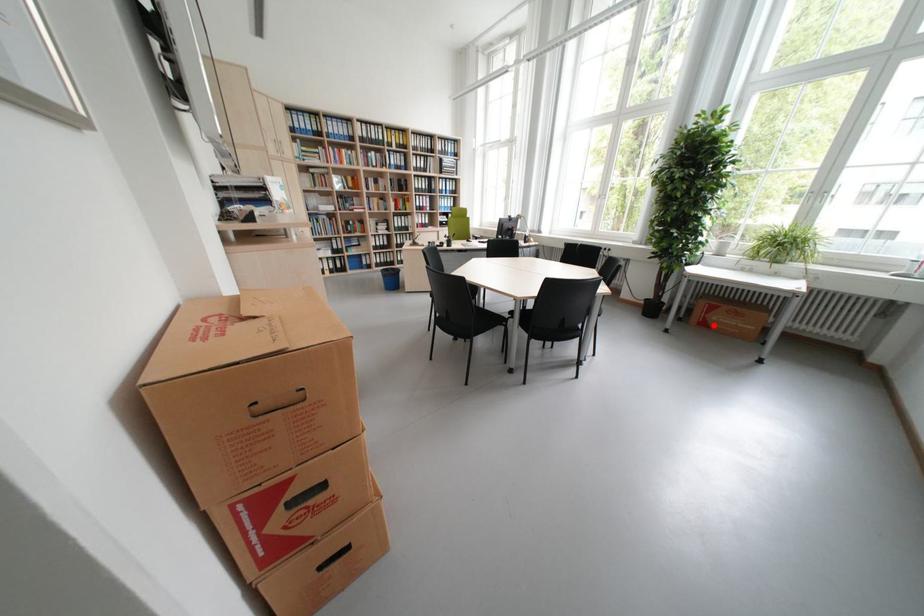
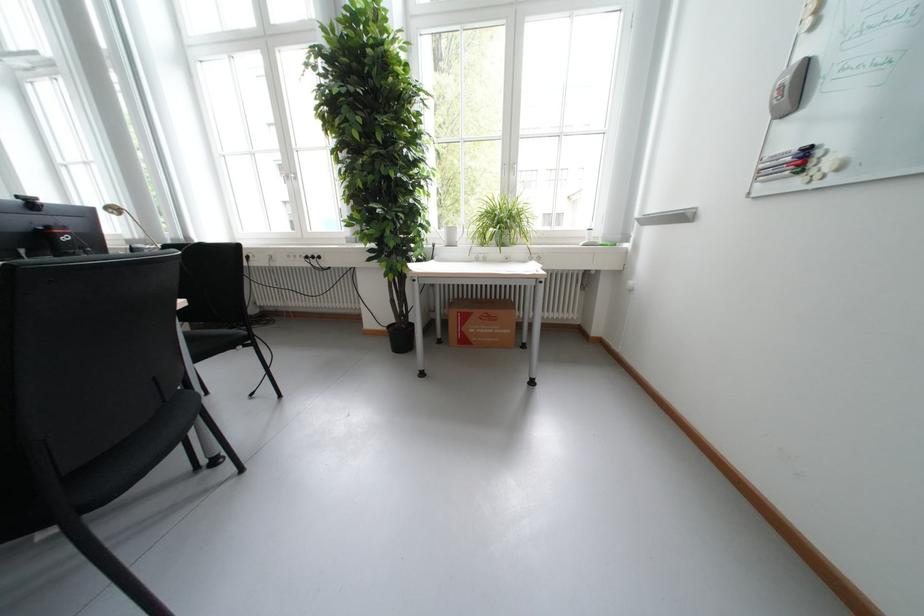
Question: I am providing you with two images of the same scene from different viewpoints. A red point is shown in image1. For the corresponding object point in image2, is it positioned nearer or farther from the camera?

Choices:
 (A) Nearer
 (B) Farther

Answer: (B)